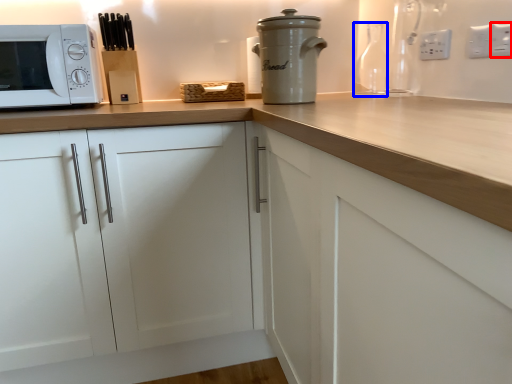
Question: Which of the following is the closest to the observer, electric outlet (highlighted by a red box) or bottle (highlighted by a blue box)?

Choices:
 (A) electric outlet
 (B) bottle

Answer: (A)